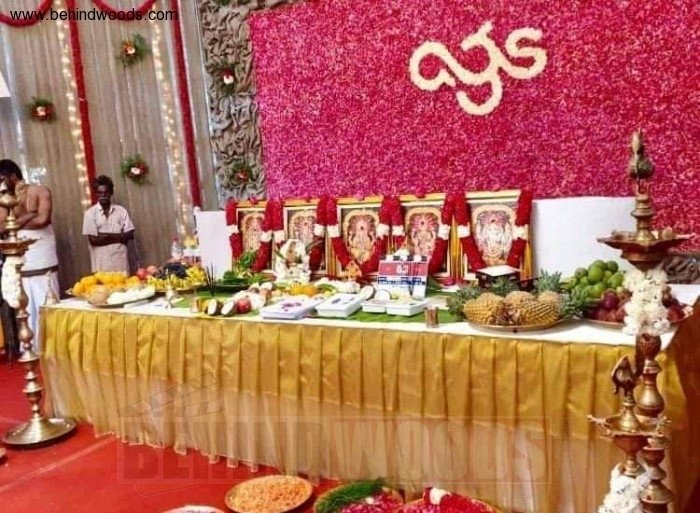
The image size is (700, 513). Identify the location of table cover. (306, 378).